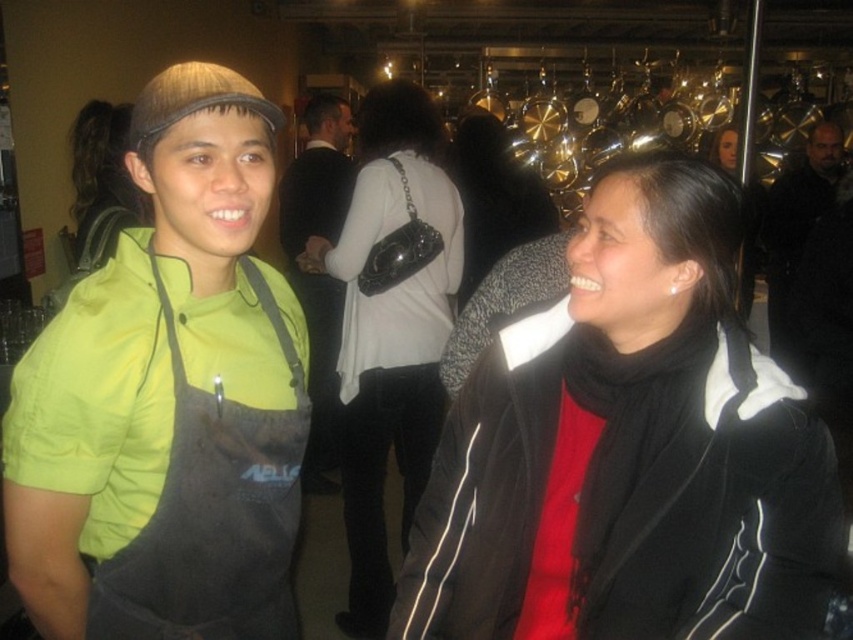
Between black matte jacket at center and green matte apron at left, which one is positioned higher?

green matte apron at left is above.

Which is below, black matte jacket at center or green matte apron at left?

black matte jacket at center is below.

You are a GUI agent. You are given a task and a screenshot of the screen. Output one action in this format:
    pyautogui.click(x=<x>, y=<y>)
    Task: Click on the black matte jacket at center
    This screenshot has height=640, width=853.
    Given the screenshot: What is the action you would take?
    pyautogui.click(x=630, y=449)

Looking at this image, does black matte jacket at center have a greater height compared to matte black purse at center?

In fact, black matte jacket at center may be shorter than matte black purse at center.

Is black matte jacket at center closer to the viewer compared to matte black purse at center?

Yes, it is.

Locate an element on the screen. black matte jacket at center is located at coordinates (630, 449).

Locate an element on the screen. black matte jacket at center is located at coordinates (630, 449).

Does green matte apron at left lie in front of dark brown leather jacket at upper right?

Yes, it is in front of dark brown leather jacket at upper right.

Does green matte apron at left appear over dark brown leather jacket at upper right?

Actually, green matte apron at left is below dark brown leather jacket at upper right.

Between point (190, 296) and point (831, 330), which one is positioned behind?

Point (831, 330)

Locate an element on the screen. This screenshot has width=853, height=640. green matte apron at left is located at coordinates (167, 397).